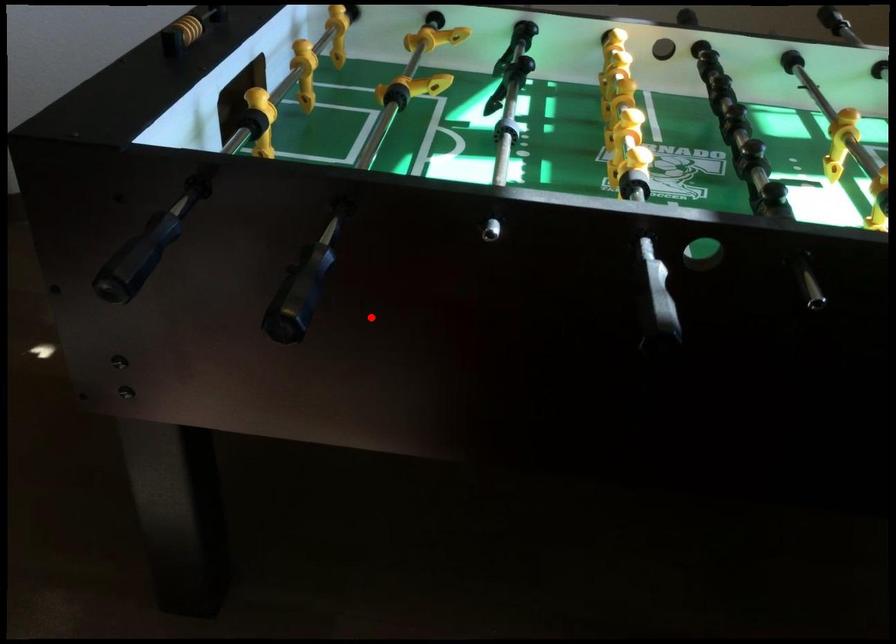
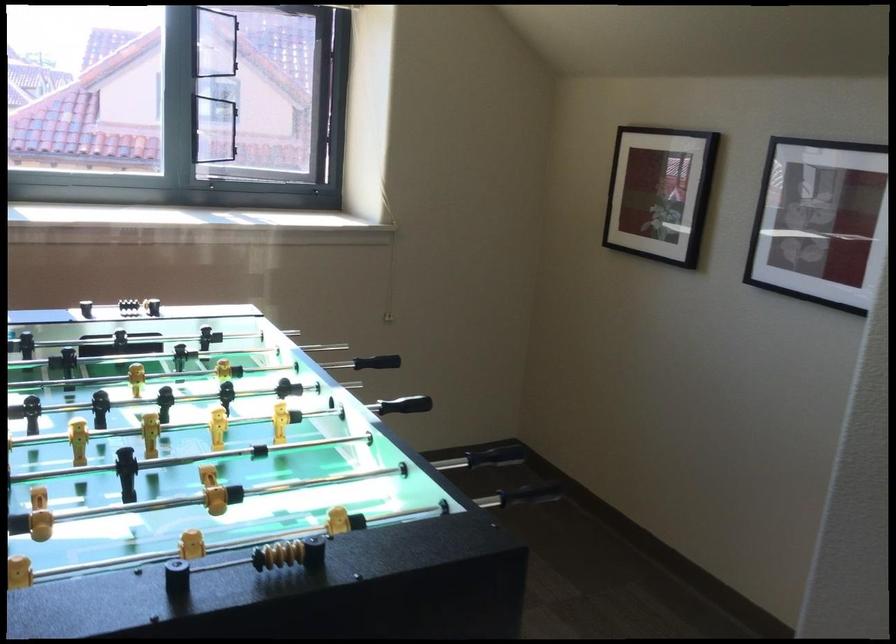
Find the pixel in the second image that matches the highlighted location in the first image.

(497, 453)